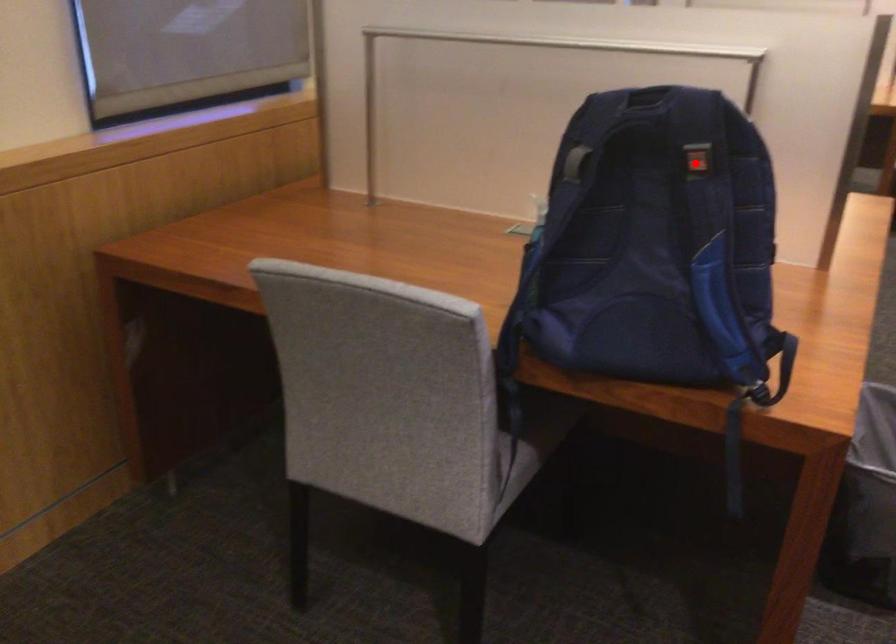
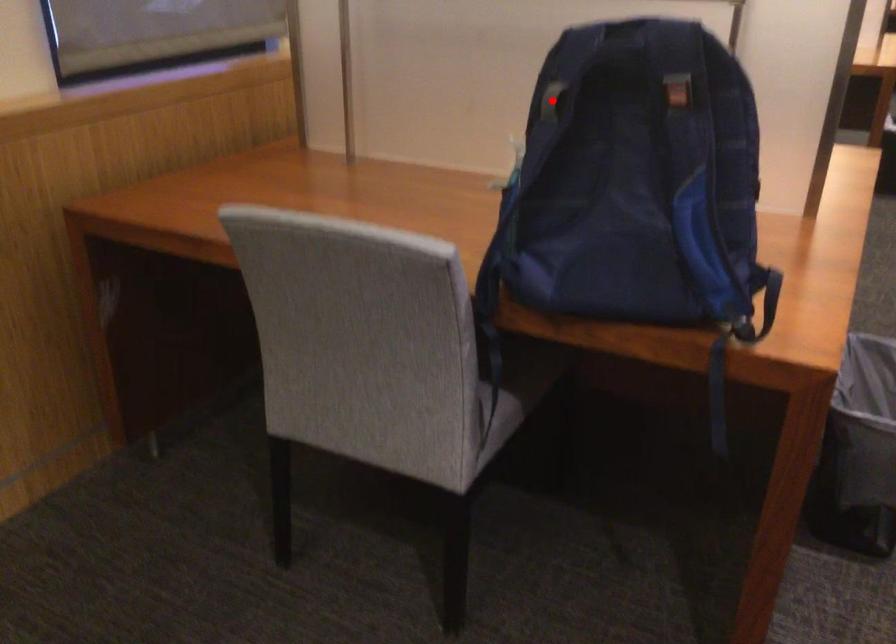
I am providing you with two images of the same scene from different viewpoints. A red point is marked on the first image and another point is marked on the second image. Do the highlighted points in image1 and image2 indicate the same real-world spot?

No